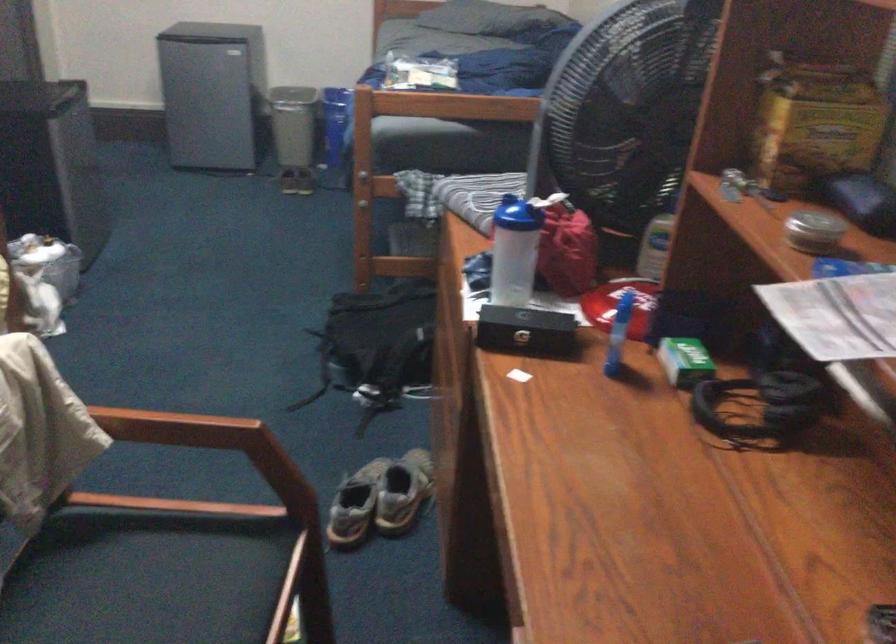
Identify the location of blue cylindrical object. The height and width of the screenshot is (644, 896). (513, 251).